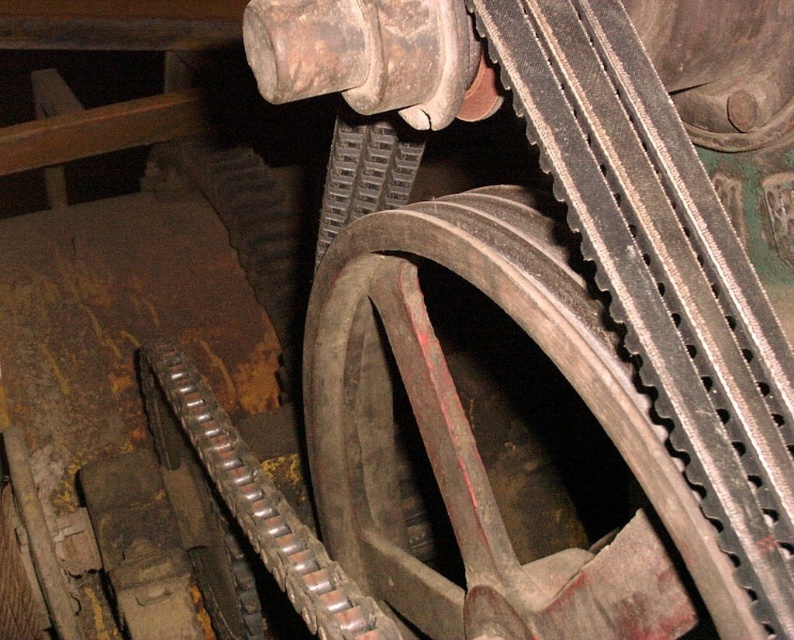
Question: Is rusty metal gear at center above rusty metal wheel at center?

Choices:
 (A) no
 (B) yes

Answer: (A)

Question: Is rusty metal gear at center closer to camera compared to rusty metal wheel at center?

Choices:
 (A) no
 (B) yes

Answer: (B)

Question: Does rusty metal gear at center appear over rusty metal wheel at center?

Choices:
 (A) no
 (B) yes

Answer: (A)

Question: Which point is farther from the camera taking this photo?

Choices:
 (A) (580, 554)
 (B) (338, 188)

Answer: (B)